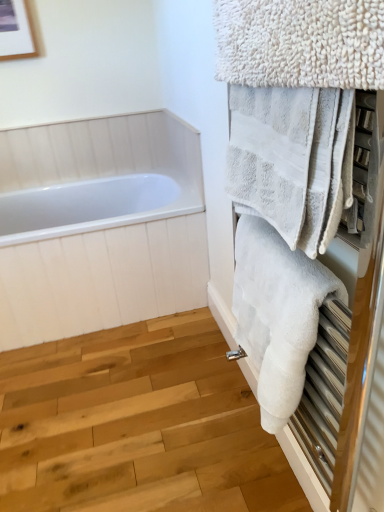
Describe the element at coordinates (300, 42) in the screenshot. This screenshot has width=384, height=512. I see `white fluffy towel at upper right, placed as the first towel when sorted from top to bottom` at that location.

Image resolution: width=384 pixels, height=512 pixels. Identify the location of white fluffy towel at upper right, marked as the third towel in a bottom-to-top arrangement. (300, 42).

Is point (295, 194) less distant than point (163, 285)?

Yes, point (295, 194) is closer to viewer.

At what (x,y) coordinates should I click in order to perform the action: click on the 1st towel positioned above the white glossy bathtub at left (from the image's perspective). Please return your answer as a coordinate pair (x, y). Looking at the image, I should click on (292, 160).

Who is taller, white fluffy towel at upper right, marked as the second towel in a bottom-to-top arrangement, or white glossy bathtub at left?

With more height is white glossy bathtub at left.

Between white fluffy towel at upper right, the 2th towel from the top, and white glossy bathtub at left, which one has larger size?

white glossy bathtub at left is bigger.

How different are the orientations of white glossy bathtub at left and white fluffy towel at right, placed as the 1th towel when sorted from bottom to top, in degrees?

90.2 degrees.

Considering their positions, is white glossy bathtub at left located in front of or behind white fluffy towel at right, marked as the 3th towel in a top-to-bottom arrangement?

In the image, white glossy bathtub at left appears behind white fluffy towel at right, marked as the 3th towel in a top-to-bottom arrangement.

In terms of height, does white glossy bathtub at left look taller or shorter compared to white fluffy towel at right, placed as the 1th towel when sorted from bottom to top?

Clearly, white glossy bathtub at left is taller compared to white fluffy towel at right, placed as the 1th towel when sorted from bottom to top.

Is white glossy bathtub at left next to white fluffy towel at right, placed as the 1th towel when sorted from bottom to top, and touching it?

No, white glossy bathtub at left is not in contact with white fluffy towel at right, placed as the 1th towel when sorted from bottom to top.

Who is more distant, white fluffy towel at upper right, the 2th towel from the top, or white fluffy towel at upper right, placed as the first towel when sorted from top to bottom?

Positioned behind is white fluffy towel at upper right, the 2th towel from the top.

Consider the image. Is white fluffy towel at upper right, the 2th towel from the top, aimed at white fluffy towel at upper right, placed as the first towel when sorted from top to bottom?

No, white fluffy towel at upper right, the 2th towel from the top, is not aimed at white fluffy towel at upper right, placed as the first towel when sorted from top to bottom.

Is white fluffy towel at upper right, marked as the second towel in a bottom-to-top arrangement, not near white fluffy towel at upper right, placed as the first towel when sorted from top to bottom?

That's not correct — white fluffy towel at upper right, marked as the second towel in a bottom-to-top arrangement, is a little close to white fluffy towel at upper right, placed as the first towel when sorted from top to bottom.

Where is `the 1st towel below the white fluffy towel at upper right, marked as the third towel in a bottom-to-top arrangement (from the image's perspective)`? This screenshot has height=512, width=384. the 1st towel below the white fluffy towel at upper right, marked as the third towel in a bottom-to-top arrangement (from the image's perspective) is located at coordinates (292, 160).

How different are the orientations of white fluffy towel at upper right, marked as the third towel in a bottom-to-top arrangement, and white fluffy towel at right, placed as the 1th towel when sorted from bottom to top, in degrees?

A: There is a 0.000563-degree angle between the facing directions of white fluffy towel at upper right, marked as the third towel in a bottom-to-top arrangement, and white fluffy towel at right, placed as the 1th towel when sorted from bottom to top.

Is white fluffy towel at upper right, placed as the first towel when sorted from top to bottom, oriented towards white fluffy towel at right, marked as the 3th towel in a top-to-bottom arrangement?

No.

Looking at their sizes, would you say white fluffy towel at upper right, placed as the first towel when sorted from top to bottom, is wider or thinner than white fluffy towel at right, placed as the 1th towel when sorted from bottom to top?

Clearly, white fluffy towel at upper right, placed as the first towel when sorted from top to bottom, has less width compared to white fluffy towel at right, placed as the 1th towel when sorted from bottom to top.

From the image's perspective, is white fluffy towel at upper right, placed as the first towel when sorted from top to bottom, below white fluffy towel at right, placed as the 1th towel when sorted from bottom to top?

Actually, white fluffy towel at upper right, placed as the first towel when sorted from top to bottom, appears above white fluffy towel at right, placed as the 1th towel when sorted from bottom to top, in the image.

Is white fluffy towel at upper right, marked as the third towel in a bottom-to-top arrangement, turned away from white glossy bathtub at left?

No, white fluffy towel at upper right, marked as the third towel in a bottom-to-top arrangement,'s orientation is not away from white glossy bathtub at left.

Are white fluffy towel at upper right, marked as the third towel in a bottom-to-top arrangement, and white glossy bathtub at left making contact?

No, white fluffy towel at upper right, marked as the third towel in a bottom-to-top arrangement, is not beside white glossy bathtub at left.

From the image's perspective, is white fluffy towel at upper right, marked as the third towel in a bottom-to-top arrangement, above white glossy bathtub at left?

Correct, white fluffy towel at upper right, marked as the third towel in a bottom-to-top arrangement, appears higher than white glossy bathtub at left in the image.

Consider the image. Which is behind, white fluffy towel at upper right, marked as the third towel in a bottom-to-top arrangement, or white glossy bathtub at left?

white glossy bathtub at left is further away from the camera.

Is white glossy bathtub at left facing away from white fluffy towel at upper right, marked as the second towel in a bottom-to-top arrangement?

No, white fluffy towel at upper right, marked as the second towel in a bottom-to-top arrangement, is not at the back of white glossy bathtub at left.

Looking at their sizes, would you say white glossy bathtub at left is wider or thinner than white fluffy towel at upper right, the 2th towel from the top?

Clearly, white glossy bathtub at left has more width compared to white fluffy towel at upper right, the 2th towel from the top.

Can you confirm if white glossy bathtub at left is bigger than white fluffy towel at upper right, marked as the second towel in a bottom-to-top arrangement?

→ Yes.

Does white glossy bathtub at left contain white fluffy towel at upper right, marked as the second towel in a bottom-to-top arrangement?

No.

Is point (308, 77) positioned behind point (256, 205)?

No, it is not.

Which object is more forward, white fluffy towel at upper right, placed as the first towel when sorted from top to bottom, or white fluffy towel at upper right, the 2th towel from the top?

white fluffy towel at upper right, placed as the first towel when sorted from top to bottom, is closer to the camera.

From the image's perspective, which is below, white fluffy towel at upper right, marked as the third towel in a bottom-to-top arrangement, or white fluffy towel at upper right, marked as the second towel in a bottom-to-top arrangement?

From the image's view, white fluffy towel at upper right, marked as the second towel in a bottom-to-top arrangement, is below.

Are white fluffy towel at upper right, placed as the first towel when sorted from top to bottom, and white fluffy towel at upper right, the 2th towel from the top, located far from each other?

No.

The image size is (384, 512). I want to click on bathtub that appears below the white fluffy towel at upper right, the 2th towel from the top (from the image's perspective), so click(x=99, y=225).

Starting from the white glossy bathtub at left, which towel is the 3rd one to the right? Please provide its 2D coordinates.

[(277, 314)]

When comparing their distances from white fluffy towel at upper right, marked as the second towel in a bottom-to-top arrangement, does white fluffy towel at right, marked as the 3th towel in a top-to-bottom arrangement, or white glossy bathtub at left seem further?

The object further to white fluffy towel at upper right, marked as the second towel in a bottom-to-top arrangement, is white glossy bathtub at left.

Which object lies further to the anchor point white fluffy towel at upper right, placed as the first towel when sorted from top to bottom, white fluffy towel at upper right, marked as the second towel in a bottom-to-top arrangement, or white fluffy towel at right, placed as the 1th towel when sorted from bottom to top?

white fluffy towel at right, placed as the 1th towel when sorted from bottom to top, is positioned further to the anchor white fluffy towel at upper right, placed as the first towel when sorted from top to bottom.

Estimate the real-world distances between objects in this image. Which object is closer to white glossy bathtub at left, white fluffy towel at upper right, marked as the second towel in a bottom-to-top arrangement, or white fluffy towel at upper right, placed as the first towel when sorted from top to bottom?

Based on the image, white fluffy towel at upper right, marked as the second towel in a bottom-to-top arrangement, appears to be nearer to white glossy bathtub at left.

From the image, which object appears to be nearer to white fluffy towel at upper right, marked as the third towel in a bottom-to-top arrangement, white glossy bathtub at left or white fluffy towel at right, placed as the 1th towel when sorted from bottom to top?

The object closer to white fluffy towel at upper right, marked as the third towel in a bottom-to-top arrangement, is white fluffy towel at right, placed as the 1th towel when sorted from bottom to top.

Which object lies further to the anchor point white glossy bathtub at left, white fluffy towel at upper right, the 2th towel from the top, or white fluffy towel at right, marked as the 3th towel in a top-to-bottom arrangement?

Among the two, white fluffy towel at upper right, the 2th towel from the top, is located further to white glossy bathtub at left.

Looking at this image, when comparing their distances from white fluffy towel at right, placed as the 1th towel when sorted from bottom to top, does white fluffy towel at upper right, placed as the first towel when sorted from top to bottom, or white glossy bathtub at left seem closer?

Among the two, white fluffy towel at upper right, placed as the first towel when sorted from top to bottom, is located nearer to white fluffy towel at right, placed as the 1th towel when sorted from bottom to top.

Considering their positions, is white fluffy towel at upper right, marked as the second towel in a bottom-to-top arrangement, positioned closer to white fluffy towel at right, marked as the 3th towel in a top-to-bottom arrangement, than white fluffy towel at upper right, placed as the first towel when sorted from top to bottom?

white fluffy towel at upper right, marked as the second towel in a bottom-to-top arrangement, lies closer to white fluffy towel at right, marked as the 3th towel in a top-to-bottom arrangement, than the other object.

When comparing their distances from white fluffy towel at upper right, marked as the second towel in a bottom-to-top arrangement, does white glossy bathtub at left or white fluffy towel at right, marked as the 3th towel in a top-to-bottom arrangement, seem further?

white glossy bathtub at left lies further to white fluffy towel at upper right, marked as the second towel in a bottom-to-top arrangement, than the other object.

At what (x,y) coordinates should I click in order to perform the action: click on towel between white fluffy towel at upper right, placed as the first towel when sorted from top to bottom, and white fluffy towel at right, marked as the 3th towel in a top-to-bottom arrangement, vertically. Please return your answer as a coordinate pair (x, y). Looking at the image, I should click on (292, 160).

The image size is (384, 512). In order to click on towel positioned between white fluffy towel at upper right, marked as the second towel in a bottom-to-top arrangement, and white glossy bathtub at left from near to far in this screenshot , I will do `click(277, 314)`.